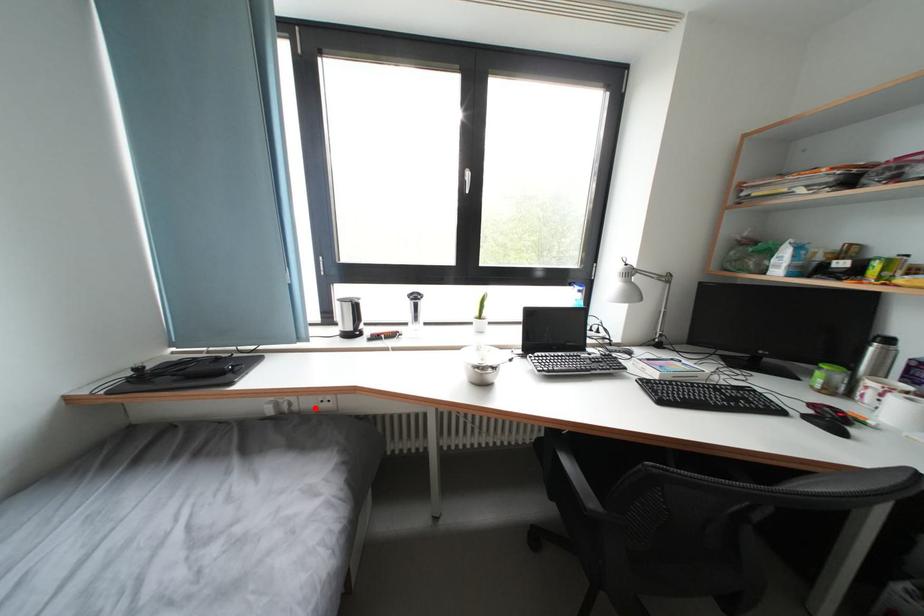
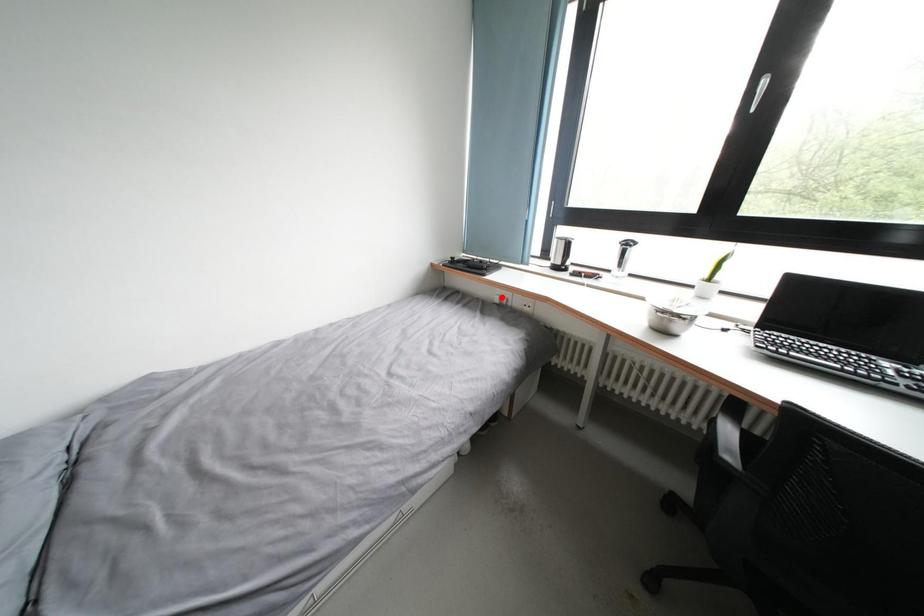
I am providing you with two images of the same scene from different viewpoints. A red point is marked on the first image and another point is marked on the second image. Does the point marked in image1 correspond to the same location as the one in image2?

No